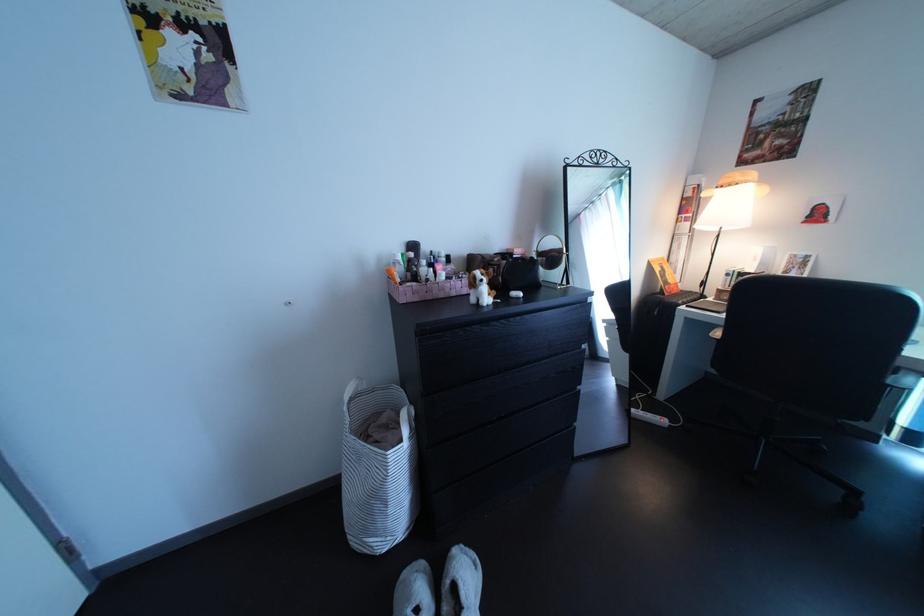
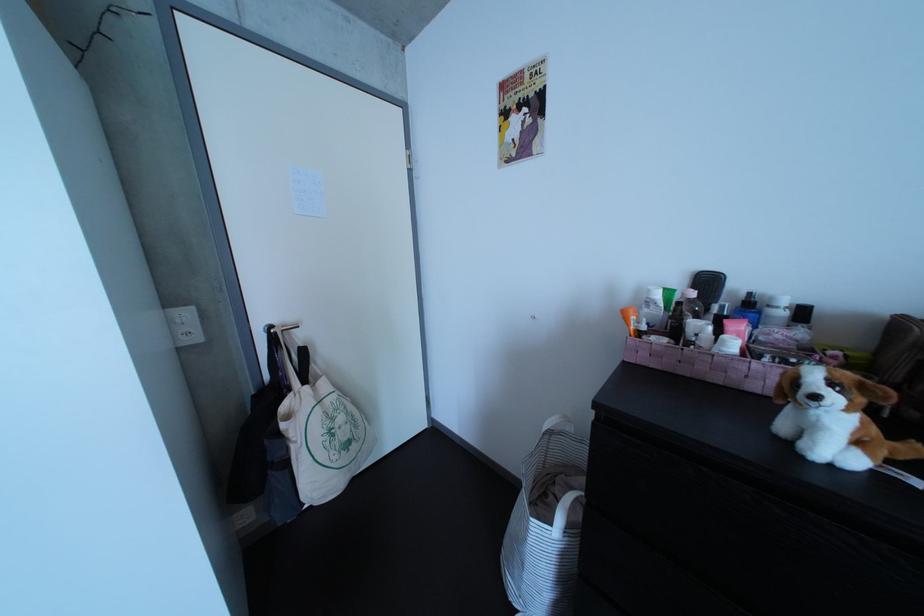
The point at (489, 286) is marked in the first image. Where is the corresponding point in the second image?

(809, 389)